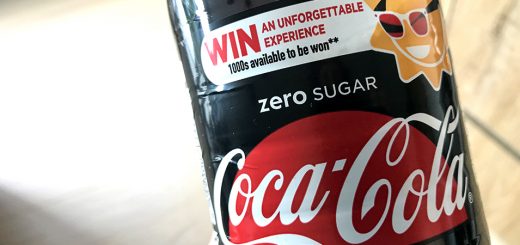
In order to click on towel in this screenshot , I will do `click(511, 78)`.